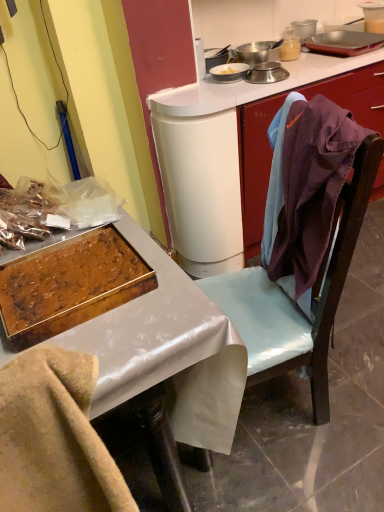
Question: Is metallic tray at left in contact with metallic silver scale at upper center, the 1th appliance positioned from the bottom?

Choices:
 (A) yes
 (B) no

Answer: (B)

Question: Does metallic tray at left appear on the left side of metallic silver scale at upper center, the 1th appliance positioned from the bottom?

Choices:
 (A) no
 (B) yes

Answer: (B)

Question: From a real-world perspective, is metallic tray at left located beneath metallic silver scale at upper center, the third appliance positioned from the top?

Choices:
 (A) yes
 (B) no

Answer: (A)

Question: Can you confirm if metallic tray at left is bigger than metallic silver scale at upper center, the 1th appliance positioned from the bottom?

Choices:
 (A) no
 (B) yes

Answer: (B)

Question: From the image's perspective, is metallic tray at left on top of metallic silver scale at upper center, the 1th appliance positioned from the bottom?

Choices:
 (A) yes
 (B) no

Answer: (B)

Question: Considering the positions of metallic tray at left and shiny brown tray at lower left in the image, is metallic tray at left wider or thinner than shiny brown tray at lower left?

Choices:
 (A) wide
 (B) thin

Answer: (A)

Question: From the image's perspective, is metallic tray at left positioned above or below shiny brown tray at lower left?

Choices:
 (A) below
 (B) above

Answer: (A)

Question: From a real-world perspective, relative to shiny brown tray at lower left, is metallic tray at left vertically above or below?

Choices:
 (A) below
 (B) above

Answer: (A)

Question: Relative to shiny brown tray at lower left, is metallic tray at left in front or behind?

Choices:
 (A) front
 (B) behind

Answer: (A)

Question: In the image, is metallic tray at left positioned in front of or behind metallic silver scale at upper center, the third appliance positioned from the top?

Choices:
 (A) behind
 (B) front

Answer: (B)

Question: Does point (162, 373) appear closer or farther from the camera than point (256, 82)?

Choices:
 (A) farther
 (B) closer

Answer: (B)

Question: Based on their positions, is metallic tray at left located to the left or right of metallic silver scale at upper center, the third appliance positioned from the top?

Choices:
 (A) right
 (B) left

Answer: (B)

Question: From a real-world perspective, is metallic tray at left physically located above or below metallic silver scale at upper center, the 1th appliance positioned from the bottom?

Choices:
 (A) below
 (B) above

Answer: (A)

Question: Is metallic silver scale at upper center, the 1th appliance positioned from the bottom, taller or shorter than shiny brown tray at lower left?

Choices:
 (A) short
 (B) tall

Answer: (A)

Question: From a real-world perspective, is metallic silver scale at upper center, the 1th appliance positioned from the bottom, positioned above or below shiny brown tray at lower left?

Choices:
 (A) below
 (B) above

Answer: (B)